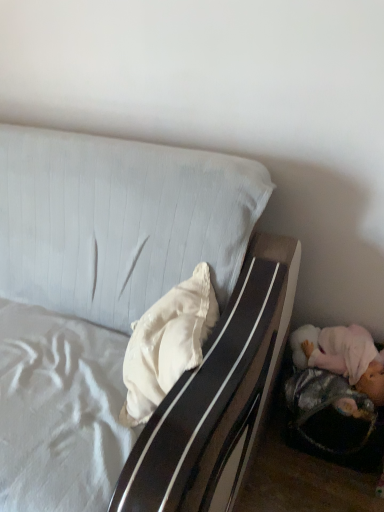
Question: In terms of width, does white satin pillow at center look wider or thinner when compared to white fabric bed at upper left?

Choices:
 (A) wide
 (B) thin

Answer: (B)

Question: In the image, is white satin pillow at center positioned in front of or behind white fabric bed at upper left?

Choices:
 (A) behind
 (B) front

Answer: (A)

Question: Looking at the image, does white satin pillow at center seem bigger or smaller compared to white fabric bed at upper left?

Choices:
 (A) big
 (B) small

Answer: (B)

Question: Is white fabric bed at upper left spatially inside white satin pillow at center, or outside of it?

Choices:
 (A) outside
 (B) inside

Answer: (A)

Question: Is white fabric bed at upper left bigger or smaller than white satin pillow at center?

Choices:
 (A) small
 (B) big

Answer: (B)

Question: Visually, is white fabric bed at upper left positioned to the left or to the right of white satin pillow at center?

Choices:
 (A) left
 (B) right

Answer: (A)

Question: From a real-world perspective, is white fabric bed at upper left physically located above or below white satin pillow at center?

Choices:
 (A) below
 (B) above

Answer: (A)